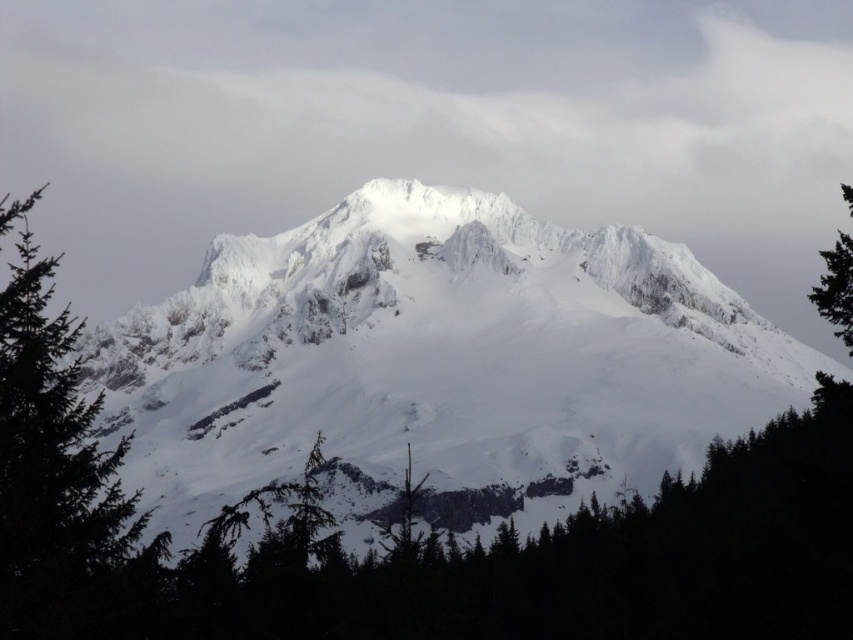
Which of these two, green matte tree at left or green matte tree at right, stands shorter?

Standing shorter between the two is green matte tree at right.

Does green matte tree at left appear over green matte tree at right?

Actually, green matte tree at left is below green matte tree at right.

Between point (136, 532) and point (837, 253), which one is positioned behind?

The point (837, 253) is behind.

I want to click on green matte tree at left, so click(x=59, y=476).

Is white snow-covered mountain at center to the left of green matte tree at right from the viewer's perspective?

Correct, you'll find white snow-covered mountain at center to the left of green matte tree at right.

In the scene shown: Can you confirm if white snow-covered mountain at center is smaller than green matte tree at right?

No.

Image resolution: width=853 pixels, height=640 pixels. In order to click on white snow-covered mountain at center in this screenshot , I will do `click(436, 364)`.

Between point (704, 387) and point (71, 600), which one is positioned behind?

The point (704, 387) is more distant.

Is white snow-covered mountain at center thinner than green matte tree at left?

Incorrect, white snow-covered mountain at center's width is not less than green matte tree at left's.

Locate an element on the screen. The image size is (853, 640). white snow-covered mountain at center is located at coordinates (436, 364).